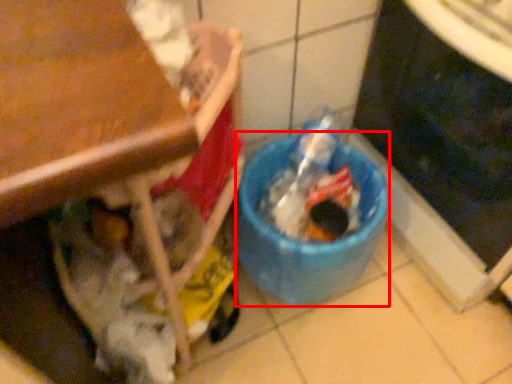
Question: From the image's perspective, what is the correct spatial positioning of recycling bin (annotated by the red box) in reference to appliance?

Choices:
 (A) below
 (B) above

Answer: (A)